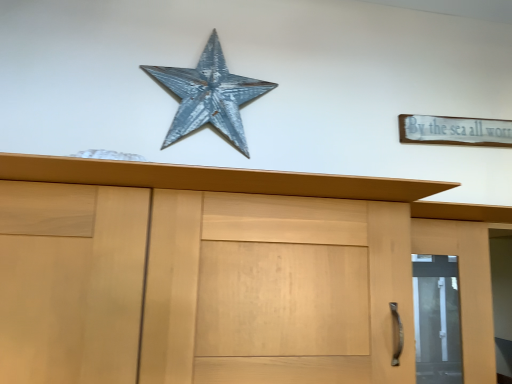
The image size is (512, 384). I want to click on white wood sign at upper right, so click(455, 130).

The image size is (512, 384). Identify the location of matte wood door at right. (466, 287).

What are the coordinates of `rusty metal star at upper center` in the screenshot? It's located at (209, 96).

In the image, is matte wood door at right positioned in front of or behind rusty metal star at upper center?

Clearly, matte wood door at right is in front of rusty metal star at upper center.

From a real-world perspective, which object stands above the other?

rusty metal star at upper center, from a real-world perspective.

Is matte wood door at right at the left side of rusty metal star at upper center?

No.

How different are the orientations of matte wood door at right and rusty metal star at upper center in degrees?

0.000169 degrees.

Does white wood sign at upper right touch matte wood door at right?

white wood sign at upper right and matte wood door at right are not in contact.

Who is more distant, white wood sign at upper right or matte wood door at right?

Positioned behind is white wood sign at upper right.

Is rusty metal star at upper center turned away from matte wood door at right?

No, rusty metal star at upper center is not facing the opposite direction of matte wood door at right.

Which is more to the right, rusty metal star at upper center or matte wood door at right?

matte wood door at right is more to the right.

Is rusty metal star at upper center not close to matte wood door at right?

rusty metal star at upper center is actually quite close to matte wood door at right.

Is rusty metal star at upper center positioned in front of matte wood door at right?

No.

From the image's perspective, between rusty metal star at upper center and white wood sign at upper right, who is located below?

white wood sign at upper right appears lower in the image.

In the image, is rusty metal star at upper center positioned in front of or behind white wood sign at upper right?

In the image, rusty metal star at upper center appears in front of white wood sign at upper right.

Is rusty metal star at upper center at the right side of white wood sign at upper right?

Incorrect, rusty metal star at upper center is not on the right side of white wood sign at upper right.

Could you tell me if rusty metal star at upper center is facing white wood sign at upper right?

No, rusty metal star at upper center does not turn towards white wood sign at upper right.

Is matte wood door at right thinner than white wood sign at upper right?

Incorrect, the width of matte wood door at right is not less than that of white wood sign at upper right.

Based on the photo, is matte wood door at right inside the boundaries of white wood sign at upper right, or outside?

matte wood door at right is not enclosed by white wood sign at upper right.

From a real-world perspective, between matte wood door at right and white wood sign at upper right, who is vertically higher?

From a 3D spatial view, white wood sign at upper right is above.

Looking at this image, could you tell me if matte wood door at right is turned towards white wood sign at upper right?

No, matte wood door at right is not turned towards white wood sign at upper right.

Considering the positions of objects white wood sign at upper right and rusty metal star at upper center in the image provided, who is more to the right, white wood sign at upper right or rusty metal star at upper center?

white wood sign at upper right.

Is white wood sign at upper right oriented towards rusty metal star at upper center?

No, white wood sign at upper right does not turn towards rusty metal star at upper center.

How much distance is there between white wood sign at upper right and rusty metal star at upper center?

A: white wood sign at upper right and rusty metal star at upper center are 30.34 inches apart from each other.

Who is bigger, white wood sign at upper right or rusty metal star at upper center?

Bigger between the two is rusty metal star at upper center.

You are a GUI agent. You are given a task and a screenshot of the screen. Output one action in this format:
    pyautogui.click(x=<x>, y=<y>)
    Task: Click on the starfish behind the matte wood door at right
    The image size is (512, 384).
    Given the screenshot: What is the action you would take?
    pyautogui.click(x=209, y=96)

At what (x,y) coordinates should I click in order to perform the action: click on magnet that appears above the matte wood door at right (from a real-world perspective). Please return your answer as a coordinate pair (x, y). Looking at the image, I should click on (455, 130).

Which object lies further to the anchor point white wood sign at upper right, matte wood door at right or rusty metal star at upper center?

Based on the image, rusty metal star at upper center appears to be further to white wood sign at upper right.

Looking at this image, when comparing their distances from rusty metal star at upper center, does matte wood door at right or white wood sign at upper right seem further?

Among the two, matte wood door at right is located further to rusty metal star at upper center.

Considering their positions, is white wood sign at upper right positioned further to matte wood door at right than rusty metal star at upper center?

rusty metal star at upper center.

From the image, which object appears to be nearer to rusty metal star at upper center, white wood sign at upper right or matte wood door at right?

The object closer to rusty metal star at upper center is white wood sign at upper right.

Which object lies further to the anchor point matte wood door at right, rusty metal star at upper center or white wood sign at upper right?

rusty metal star at upper center lies further to matte wood door at right than the other object.

From the image, which object appears to be farther from white wood sign at upper right, rusty metal star at upper center or matte wood door at right?

rusty metal star at upper center is further to white wood sign at upper right.

At what (x,y) coordinates should I click in order to perform the action: click on magnet situated between rusty metal star at upper center and matte wood door at right from left to right. Please return your answer as a coordinate pair (x, y). Looking at the image, I should click on (455, 130).